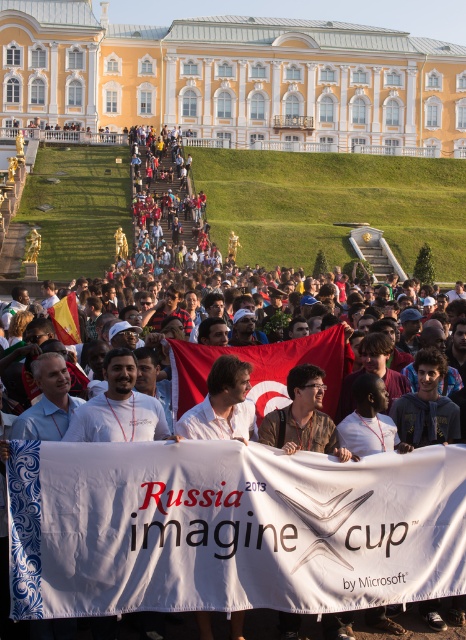
You are a photographer at the event and want to capture both the red fabric flag at center and the yellow fabric flag at center in a single shot. Which flag should you focus on first to ensure both are in frame?

You should focus on the yellow fabric flag at center first since it is wider than the red fabric flag at center, allowing you to position it appropriately to include both in the frame.

You are at the event and want to take a photo of both the red fabric flag at center and the yellow fabric flag at center. To ensure both flags are in the frame, should you position yourself to the left or right of the flags?

To capture both the red fabric flag at center and the yellow fabric flag at center in the frame, you should position yourself to the left of the flags. Since the red fabric flag at center is to the right of the yellow fabric flag at center, positioning yourself to the left will allow you to see both flags side by side.